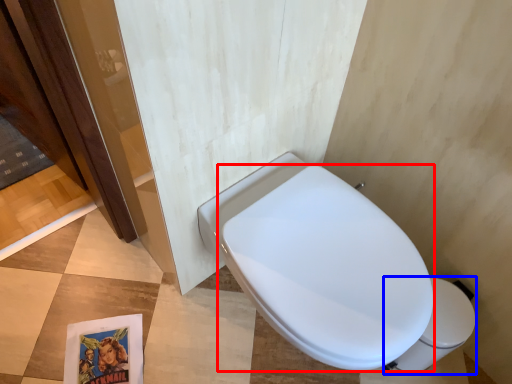
Question: Which object is closer to the camera taking this photo, bidet (highlighted by a red box) or toilet bowl (highlighted by a blue box)?

Choices:
 (A) bidet
 (B) toilet bowl

Answer: (A)